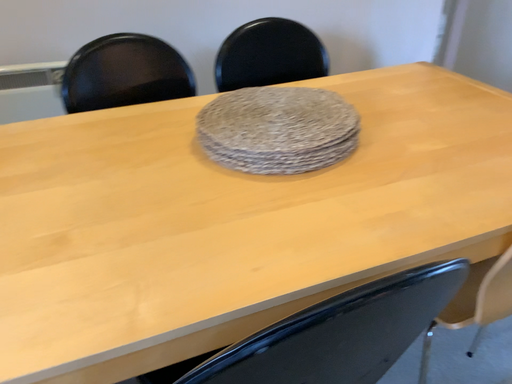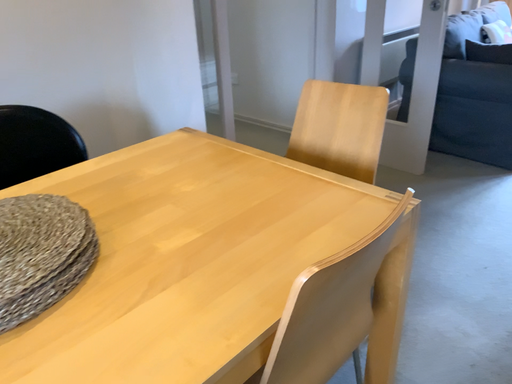
Question: How did the camera likely rotate when shooting the video?

Choices:
 (A) rotated upward
 (B) rotated downward

Answer: (A)